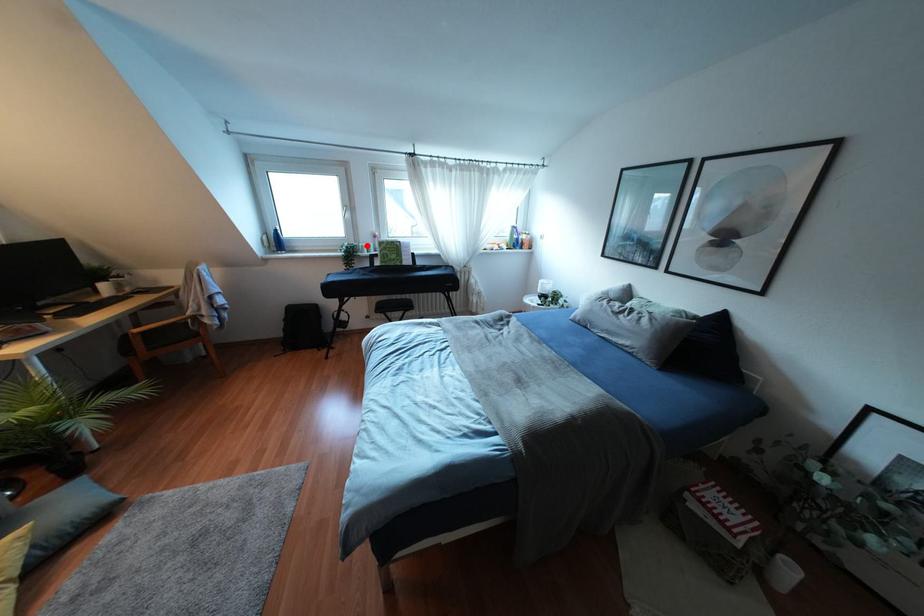
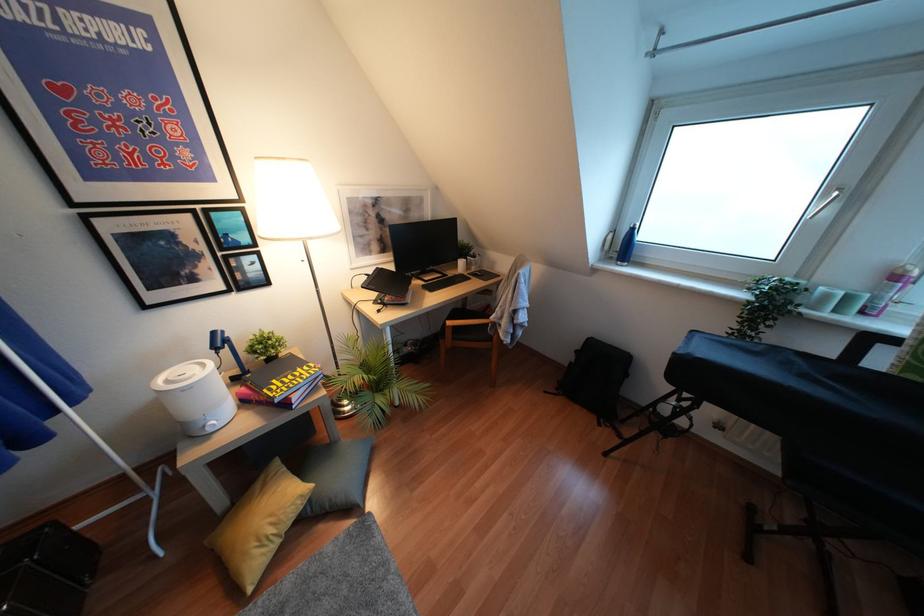
Question: I am providing you with two images of the same scene from different viewpoints. A red point is shown in image1. For the corresponding object point in image2, is it positioned nearer or farther from the camera?

Choices:
 (A) Nearer
 (B) Farther

Answer: (B)